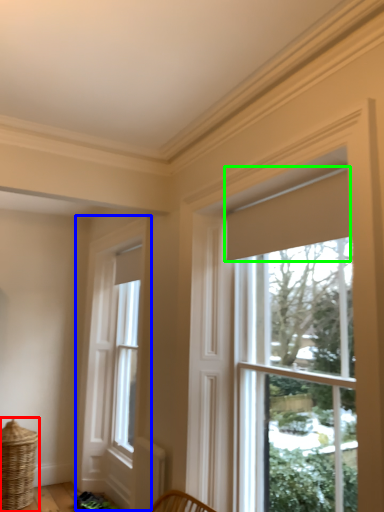
Question: Which object is positioned farthest from basket (highlighted by a red box)? Select from window (highlighted by a blue box) and curtain (highlighted by a green box).

Choices:
 (A) window
 (B) curtain

Answer: (B)